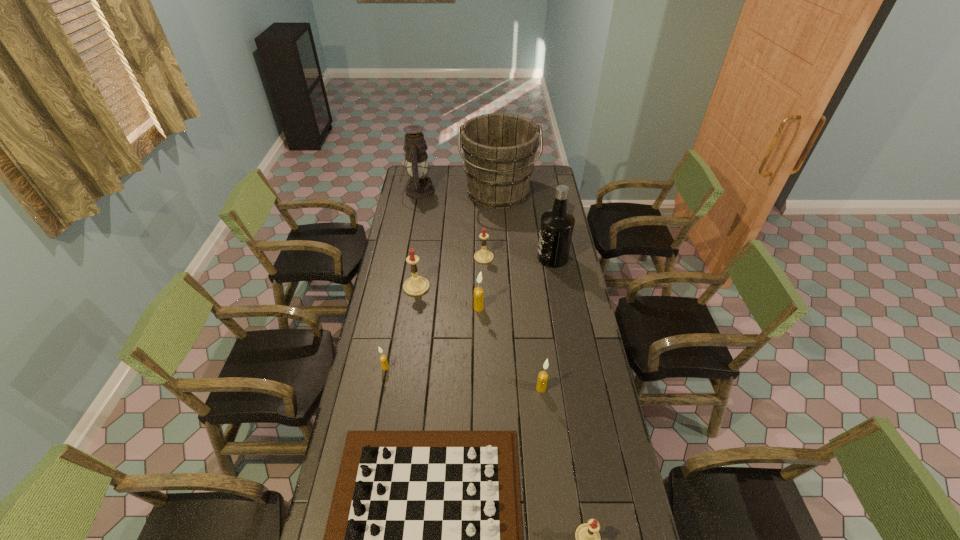
Find the location of a particular element. Image resolution: width=960 pixels, height=540 pixels. bucket is located at coordinates (499, 149).

Where is `blue oil lamp`? blue oil lamp is located at coordinates (419, 186).

This screenshot has width=960, height=540. I want to click on liquor, so click(x=557, y=224).

Where is `the second cream candle from right to left`? Image resolution: width=960 pixels, height=540 pixels. the second cream candle from right to left is located at coordinates (478, 291).

You are a GUI agent. You are given a task and a screenshot of the screen. Output one action in this format:
    pyautogui.click(x=<x>, y=<y>)
    Task: Click on the third farthest candle
    Image resolution: width=960 pixels, height=540 pixels.
    Given the screenshot: What is the action you would take?
    (478, 291)

Locate an element on the screen. The width and height of the screenshot is (960, 540). the fifth farthest object is located at coordinates (416, 285).

The height and width of the screenshot is (540, 960). What are the coordinates of `the biggest red candle` in the screenshot? It's located at (416, 285).

Locate an element on the screen. This screenshot has height=540, width=960. the farthest red candle is located at coordinates (483, 256).

Identify the location of the farthest candle. (483, 256).

You are a GUI agent. You are given a task and a screenshot of the screen. Output one action in this format:
    pyautogui.click(x=<x>, y=<y>)
    Task: Click on the third nearest object
    The image size is (960, 540).
    Given the screenshot: What is the action you would take?
    pyautogui.click(x=543, y=376)